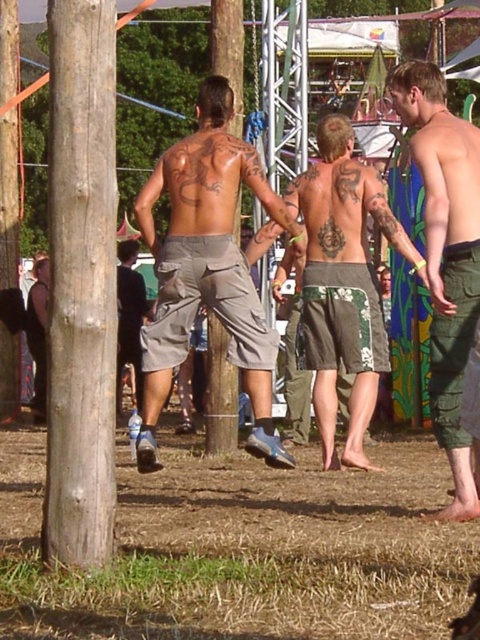
Question: Can you confirm if brown dry grass at lower center is thinner than dark gray shorts at center?

Choices:
 (A) yes
 (B) no

Answer: (B)

Question: Estimate the real-world distances between objects in this image. Which object is closer to the brown wood pole at center?

Choices:
 (A) green camouflage shorts at center
 (B) light brown wood pole at left

Answer: (A)

Question: Is brown dry grass at lower center smaller than green camouflage pants at right?

Choices:
 (A) no
 (B) yes

Answer: (B)

Question: Which of the following is the farthest from the observer?

Choices:
 (A) (111, 216)
 (B) (367, 355)
 (C) (442, 100)

Answer: (B)

Question: Is brown dry grass at lower center smaller than green camouflage shorts at center?

Choices:
 (A) no
 (B) yes

Answer: (B)

Question: Which point is farther to the camera?

Choices:
 (A) brown dry grass at lower center
 (B) green camouflage shorts at center
 (C) matte khaki shorts at center

Answer: (B)